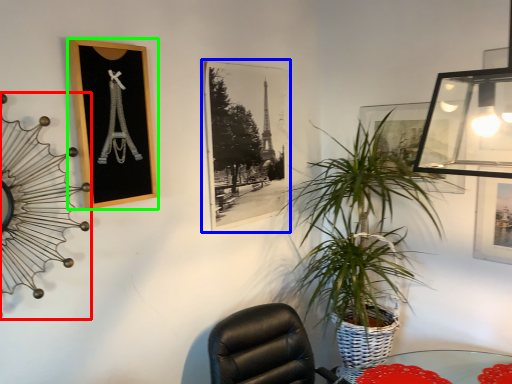
Question: Considering the real-world distances, which object is closest to clock (highlighted by a red box)? picture frame (highlighted by a blue box) or picture frame (highlighted by a green box).

Choices:
 (A) picture frame
 (B) picture frame

Answer: (B)